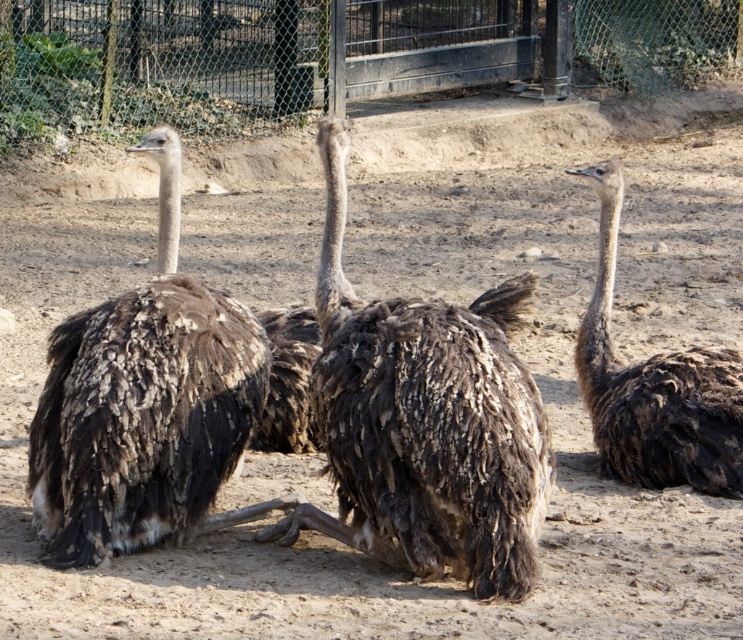
Which is below, metallic chain-link fence at upper center or dark brown feathered ostrich at left?

dark brown feathered ostrich at left is below.

Does metallic chain-link fence at upper center appear over dark brown feathered ostrich at left?

Correct, metallic chain-link fence at upper center is located above dark brown feathered ostrich at left.

Who is more distant from viewer, (270, 28) or (207, 518)?

Positioned behind is point (270, 28).

Locate an element on the screen. The image size is (743, 640). metallic chain-link fence at upper center is located at coordinates (331, 54).

Who is more distant from viewer, (376, 531) or (80, 353)?

Positioned behind is point (80, 353).

Who is lower down, brown fuzzy ostrich at center or dark brown feathered ostrich at left?

brown fuzzy ostrich at center is below.

This screenshot has height=640, width=743. What are the coordinates of `brown fuzzy ostrich at center` in the screenshot? It's located at (424, 420).

From the picture: Who is lower down, brown fuzzy ostrich at center or brown fuzzy ostrich at right?

brown fuzzy ostrich at center

This screenshot has width=743, height=640. I want to click on brown fuzzy ostrich at center, so click(x=424, y=420).

The width and height of the screenshot is (743, 640). I want to click on brown fuzzy ostrich at center, so click(x=424, y=420).

In order to click on brown fuzzy ostrich at center in this screenshot , I will do `click(424, 420)`.